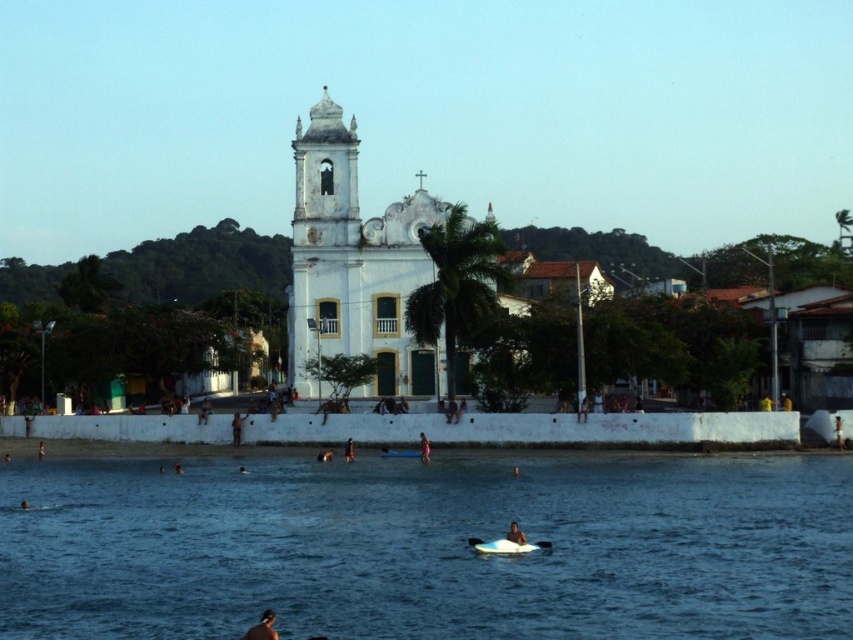
You are standing on the beach and want to take a photo of both the white matte church at center and the smooth skin person at center. Which object should you focus on first to ensure both are in the frame?

You should focus on the white matte church at center first because it is closer to you than the smooth skin person at center, ensuring both are in the frame.

You are standing at the beach in front of the white matte church at center. You want to take a photo of the church with your phone. If your phone can capture objects up to 200 meters away, will the church be visible in your photo?

The white matte church at center is 165.49 meters away from the camera. Since the phone can capture up to 200 meters, the church will be visible in the photo.